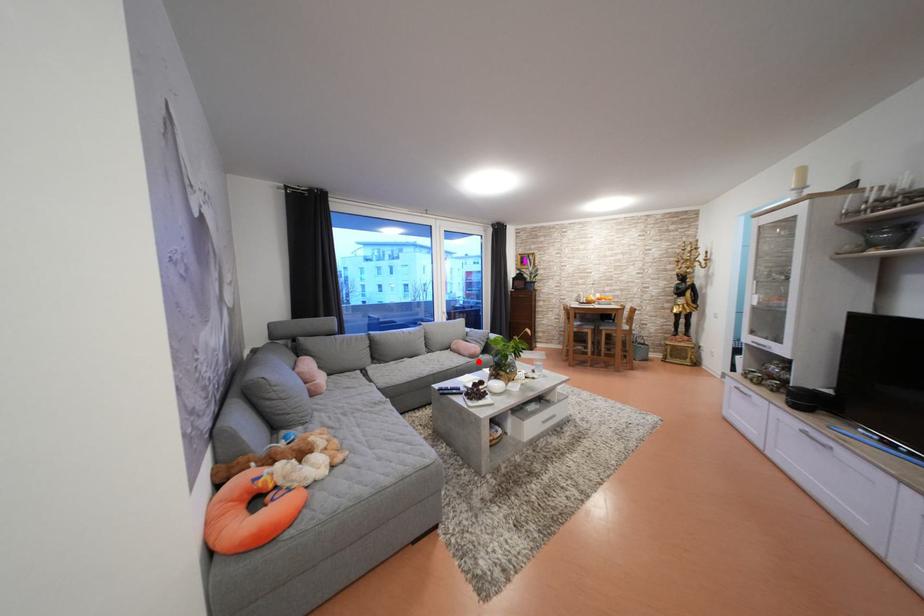
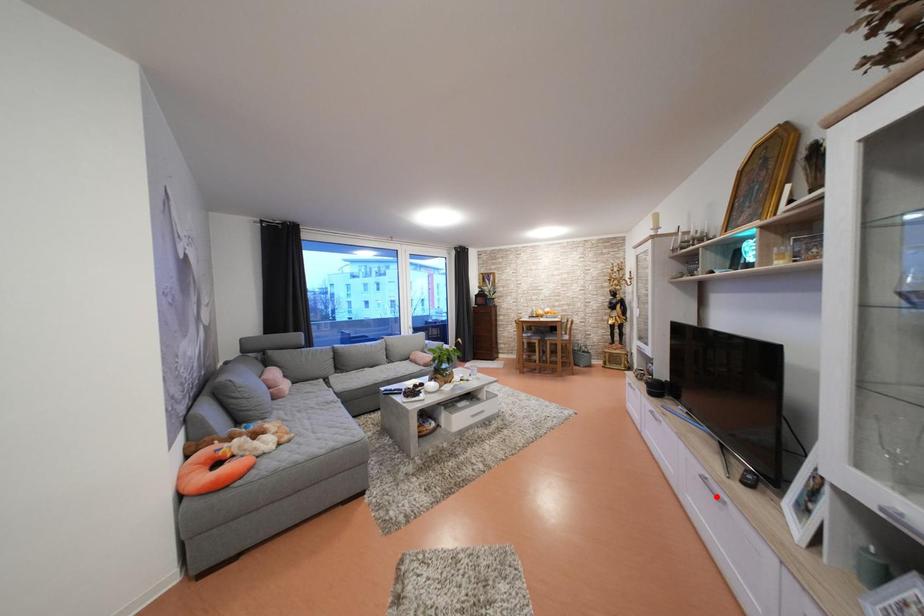
I am providing you with two images of the same scene from different viewpoints. A red point is marked on the first image and another point is marked on the second image. Are the points marked in image1 and image2 representing the same 3D position?

No